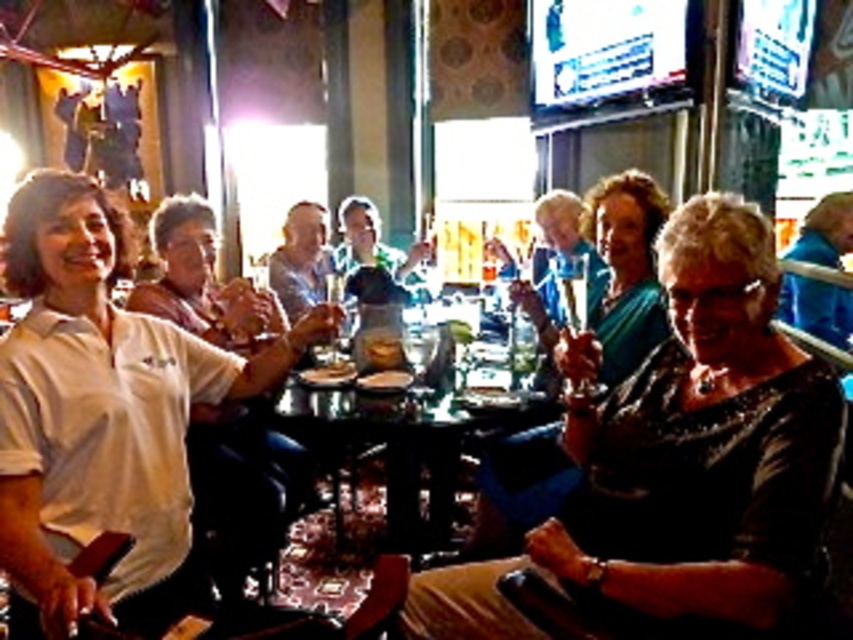
You are a server carrying a tray of drinks. You need to deliver a drink to the person wearing the white matte shirt at left and another to the person in the smooth blue shirt at center. If your tray can hold drinks for a maximum distance of 2 meters before needing to rest, can you serve both without resting?

The distance between the white matte shirt at left and smooth blue shirt at center is 1.82 meters, which is under the 2 meter limit. Therefore, you can serve both without needing to rest your tray.

You are a photographer standing in the scene and want to take a closeup photo of the white matte shirt at left without moving any objects. Can you reach it with your camera lens? Assume your camera has a 0.5 meter minimum focusing distance.

The white matte shirt at left is 1.36 meters away from viewer, which is beyond the camera lens minimum focusing distance of 0.5 meters. Therefore, you can take a closeup photo of the white matte shirt at left without needing to move closer.

You are a photographer at the event and want to capture a photo of both the white matte shirt at left and the smooth blue shirt at center. Since you want both subjects to be clearly visible in the photo, which shirt should you focus on first to ensure the other is also in focus?

You should focus on the white matte shirt at left first because it is in front of the smooth blue shirt at center, ensuring both will be in focus if the depth of field is sufficient.